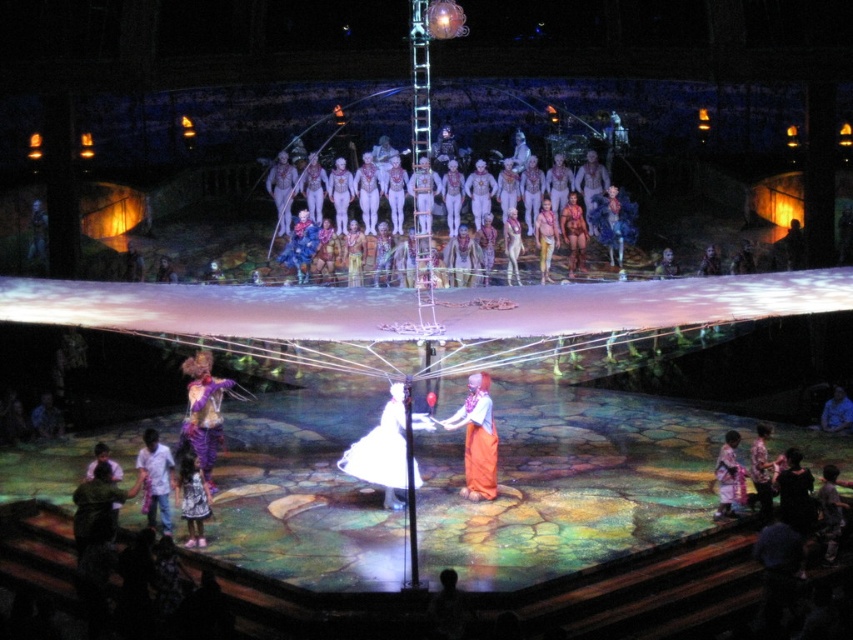
Which is behind, point (399, 440) or point (483, 432)?

The point (483, 432) is behind.

Locate an element on the screen. white satin dress at center is located at coordinates (381, 449).

Is point (349, 474) farther from viewer compared to point (489, 435)?

That is False.

I want to click on white satin dress at center, so click(x=381, y=449).

Measure the distance from purple velvet costume at center to white cotton shirt at lower left.

A distance of 7.15 meters exists between purple velvet costume at center and white cotton shirt at lower left.

Where is `purple velvet costume at center`? purple velvet costume at center is located at coordinates (202, 412).

Locate an element on the screen. The height and width of the screenshot is (640, 853). purple velvet costume at center is located at coordinates (202, 412).

Does white cotton shirt at lower left have a greater height compared to patterned fabric dress at lower right?

Incorrect, white cotton shirt at lower left's height is not larger of patterned fabric dress at lower right's.

Is white cotton shirt at lower left shorter than patterned fabric dress at lower right?

Yes, white cotton shirt at lower left is shorter than patterned fabric dress at lower right.

In the scene shown: Who is more forward, [154,515] or [718,500]?

Point [154,515] is more forward.

At what (x,y) coordinates should I click in order to perform the action: click on white cotton shirt at lower left. Please return your answer as a coordinate pair (x, y). Looking at the image, I should click on (155, 480).